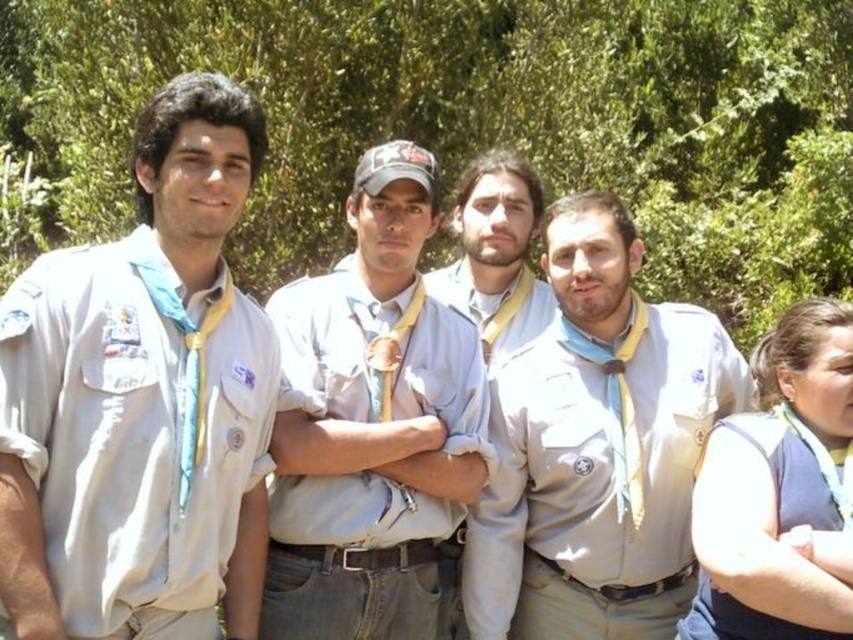
Which is above, light beige uniform at left or matte khaki shirt at center?

Positioned higher is light beige uniform at left.

At what (x,y) coordinates should I click in order to perform the action: click on light beige uniform at left. Please return your answer as a coordinate pair (x, y). The height and width of the screenshot is (640, 853). Looking at the image, I should click on (142, 401).

Between light beige uniform at left and light blue fabric at right, which one appears on the right side from the viewer's perspective?

light blue fabric at right

Looking at this image, is light beige uniform at left taller than light blue fabric at right?

Yes, light beige uniform at left is taller than light blue fabric at right.

Identify the location of light beige uniform at left. (142, 401).

This screenshot has width=853, height=640. I want to click on light beige uniform at left, so click(x=142, y=401).

Which is in front, point (747, 520) or point (488, 316)?

Point (747, 520) is in front.

Based on the photo, can you confirm if light blue fabric at right is positioned below light beige uniform at center?

Indeed, light blue fabric at right is positioned under light beige uniform at center.

Is point (737, 413) farther from viewer compared to point (511, 340)?

No.

Where is `light blue fabric at right`? light blue fabric at right is located at coordinates point(779,490).